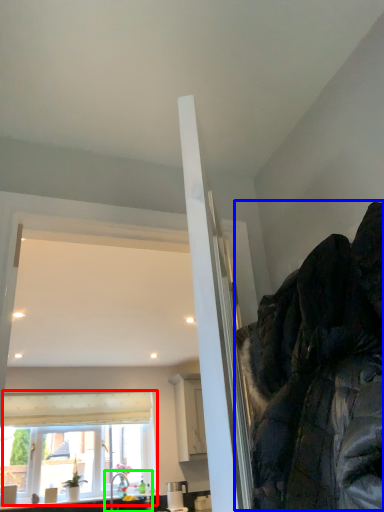
Question: Based on their relative distances, which object is farther from window (highlighted by a red box)? Choose from jacket (highlighted by a blue box) and sink (highlighted by a green box).

Choices:
 (A) jacket
 (B) sink

Answer: (A)